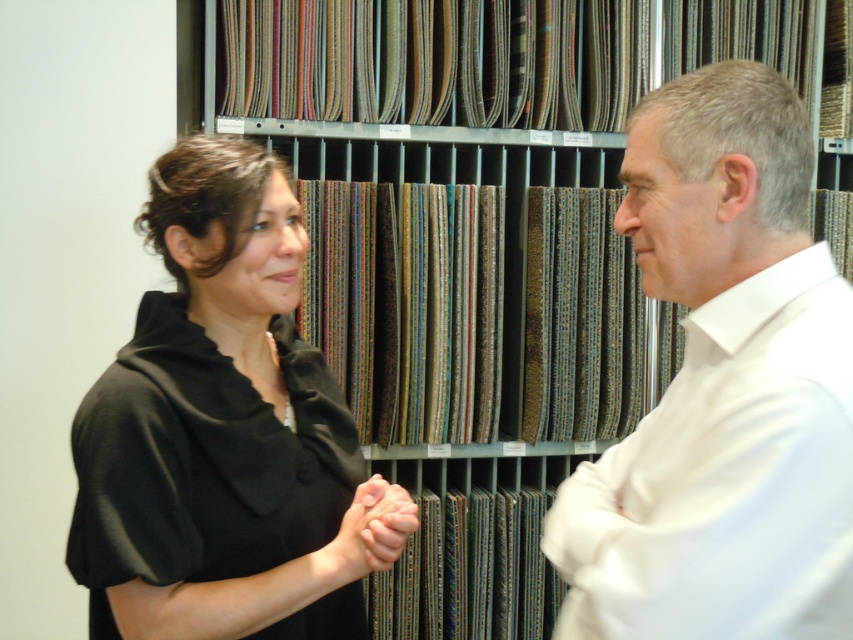
You are a customer in a fabric store and see the white satin shirt at right displayed at point [723,388]. If you want to reach it, should you move towards the left or right from your current position?

The white satin shirt at right is located at point [723,388], so you should move towards the right to reach it.

You are a tailor who needs to hand over the white satin shirt at right to the client. The client has their smooth skin hands at center ready to receive it. Can you place the shirt directly into their hands without moving either object?

The white satin shirt at right is positioned over smooth skin hands at center, so yes, you can place the shirt directly into their hands without moving either object.